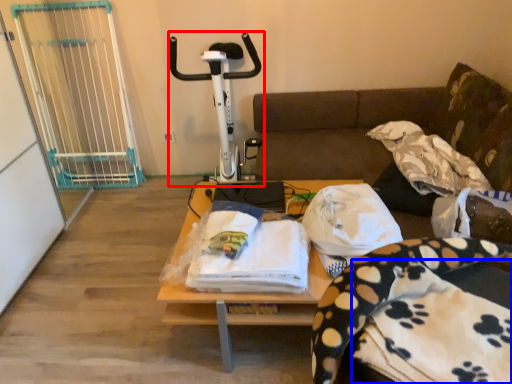
Question: Which point is further to the camera, sport equipment (highlighted by a red box) or blanket (highlighted by a blue box)?

Choices:
 (A) sport equipment
 (B) blanket

Answer: (A)